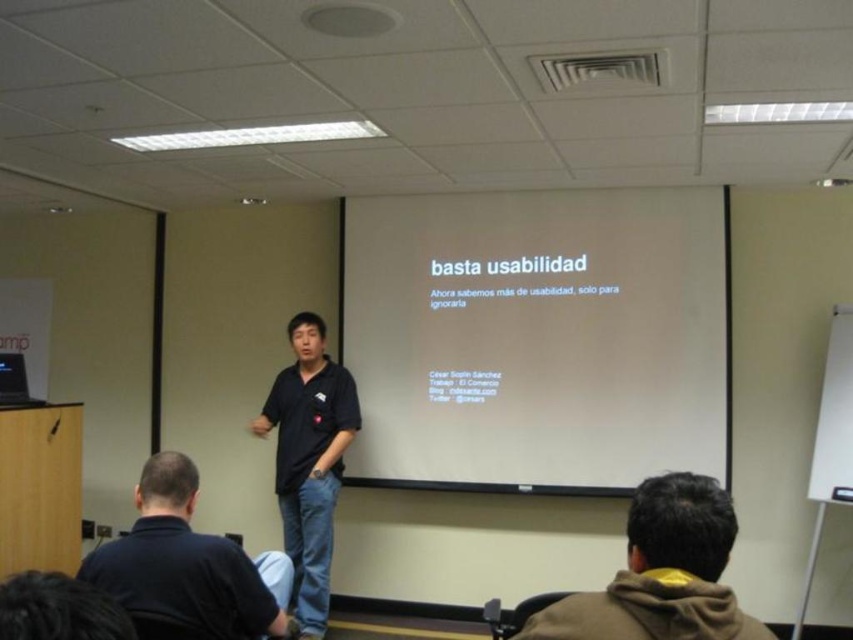
Question: Which object is positioned farthest from the brown fleece jacket at lower right?

Choices:
 (A) black matte shirt at center
 (B) dark blue shirt at lower left
 (C) white matte projection screen at center

Answer: (C)

Question: Is the position of white matte projection screen at center less distant than that of dark blue shirt at lower left?

Choices:
 (A) yes
 (B) no

Answer: (B)

Question: From the image, what is the correct spatial relationship of white matte projection screen at center in relation to brown fleece jacket at lower right?

Choices:
 (A) right
 (B) left

Answer: (A)

Question: Considering the real-world distances, which object is farthest from the white matte projection screen at center?

Choices:
 (A) dark blue shirt at lower left
 (B) black matte shirt at center
 (C) brown fleece jacket at lower right

Answer: (C)

Question: Considering the relative positions of white matte projection screen at center and dark blue shirt at lower left in the image provided, where is white matte projection screen at center located with respect to dark blue shirt at lower left?

Choices:
 (A) left
 (B) right

Answer: (B)

Question: Which of the following is the closest to the observer?

Choices:
 (A) brown fleece jacket at lower right
 (B) white matte projection screen at center
 (C) black matte shirt at center
 (D) dark blue shirt at lower left

Answer: (A)